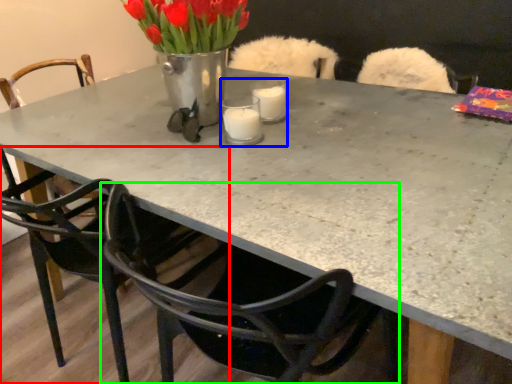
Question: Which object is positioned farthest from chair (highlighted by a red box)? Select from candle holder (highlighted by a blue box) and chair (highlighted by a green box).

Choices:
 (A) candle holder
 (B) chair

Answer: (A)